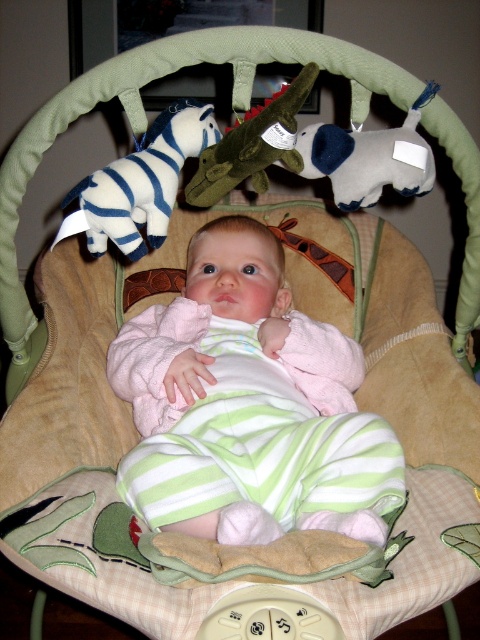
You are a photographer setting up a closeup shot of the baby and the toys. Since you want to focus on the pink fleece baby at center and the felt elephant at center, which one should you adjust your camera lens to focus on first considering their sizes?

The pink fleece baby at center is bigger than the felt elephant at center, so you should adjust your camera lens to focus on the pink fleece baby at center first because it is larger and likely the main subject.

You are a photographer taking a picture of the pink fleece baby at center and the velvety green plush crocodile at center. Which object is closer to the camera?

The pink fleece baby at center is closer to the camera than the velvety green plush crocodile at center.

You are a parent observing the baby in the bouncer chair. You notice two toys hanging above the baby. Which toy is larger between the felt elephant at center and the velvety green plush crocodile at center?

The felt elephant at center is bigger than the velvety green plush crocodile at center.